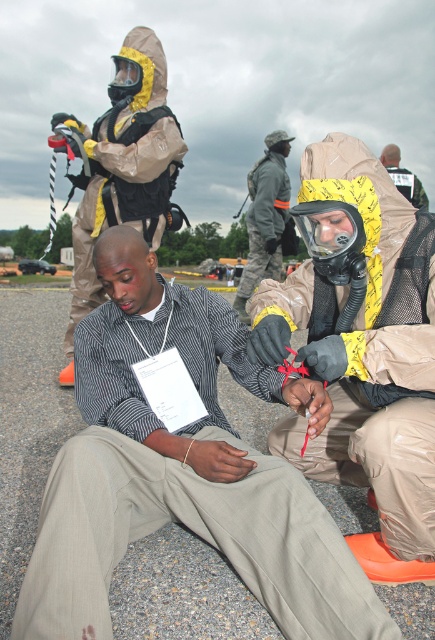
You are a safety inspector evaluating the layout of this emergency training area. You notice two items of equipment labeled as the matte khaki suit at center and the matte black gas mask at upper center. Based on their spatial relationship, which item takes up more physical space in the scene?

The matte black gas mask at upper center occupies more space than the matte khaki suit at center according to the description.